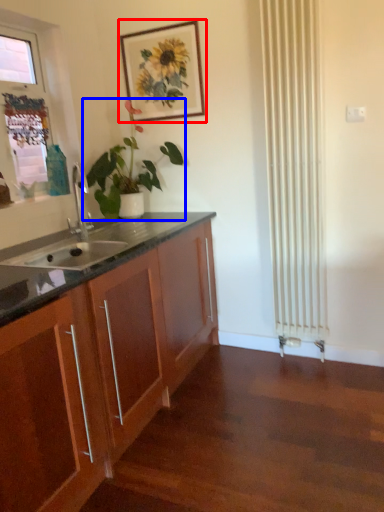
Question: Which object is closer to the camera taking this photo, picture frame (highlighted by a red box) or houseplant (highlighted by a blue box)?

Choices:
 (A) picture frame
 (B) houseplant

Answer: (B)